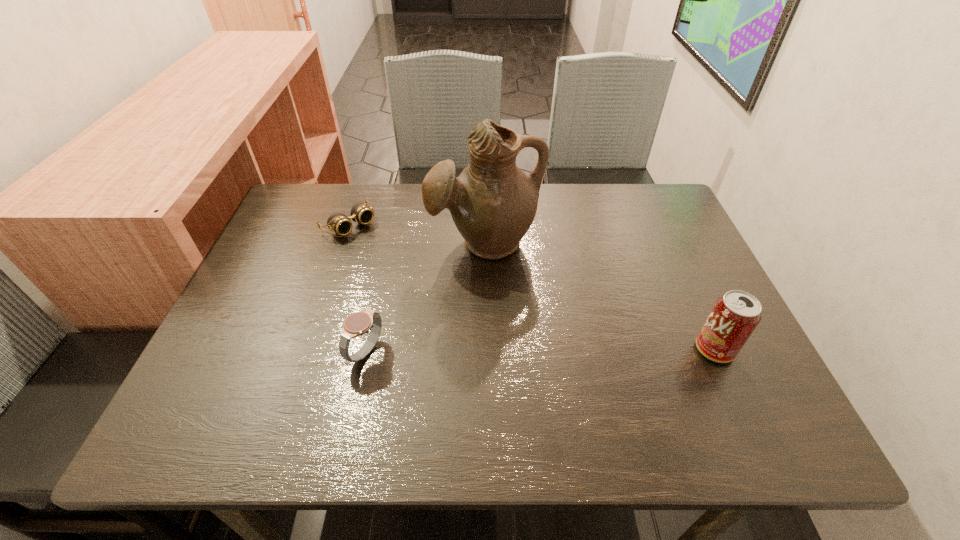
This screenshot has width=960, height=540. I want to click on the third object from right to left, so click(358, 323).

You are a GUI agent. You are given a task and a screenshot of the screen. Output one action in this format:
    pyautogui.click(x=<x>, y=<y>)
    Task: Click on the second shortest object
    
    Given the screenshot: What is the action you would take?
    pyautogui.click(x=358, y=323)

Locate an element on the screen. Image resolution: width=960 pixels, height=540 pixels. soda can is located at coordinates (735, 315).

Where is `the rightmost object`? the rightmost object is located at coordinates (735, 315).

Find the location of `the third object from left to right`. the third object from left to right is located at coordinates (493, 203).

Locate an element on the screen. The image size is (960, 540). pitcher is located at coordinates (493, 203).

The width and height of the screenshot is (960, 540). In order to click on the shortest object in this screenshot , I will do `click(338, 222)`.

At what (x,y) coordinates should I click in order to perform the action: click on the leftmost object. Please return your answer as a coordinate pair (x, y). This screenshot has height=540, width=960. Looking at the image, I should click on (338, 222).

Where is `free space located 0.380m on the back of the third object from right to left`? free space located 0.380m on the back of the third object from right to left is located at coordinates (395, 224).

Locate an element on the screen. free region located on the left of the soda can is located at coordinates (543, 349).